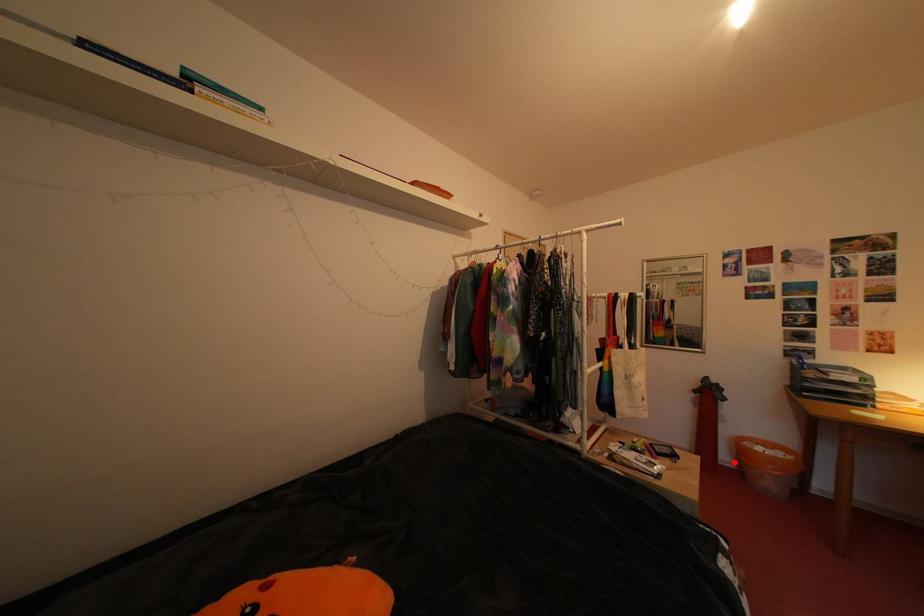
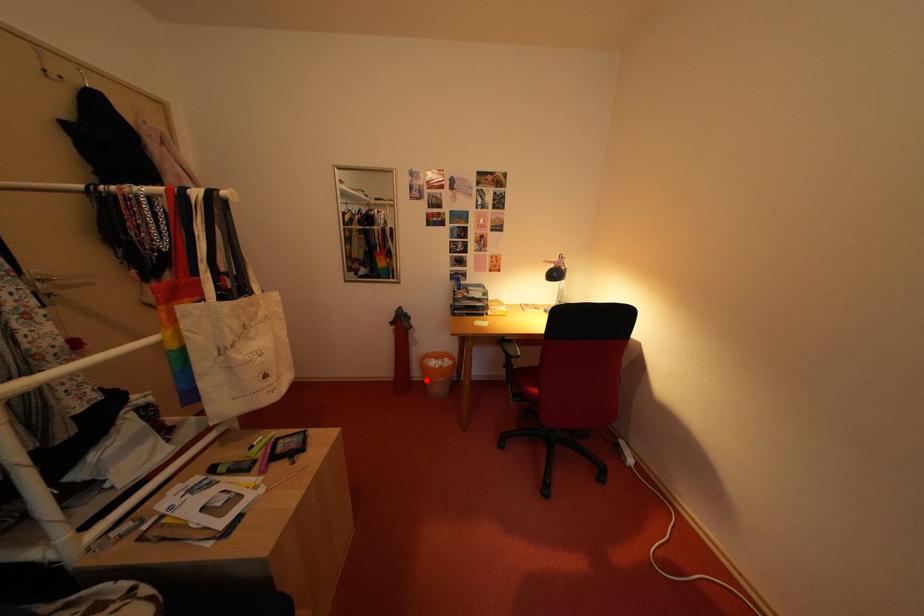
I am providing you with two images of the same scene from different viewpoints. A red point is marked on the first image and another point is marked on the second image. Is the marked point in image1 the same physical position as the marked point in image2?

Yes